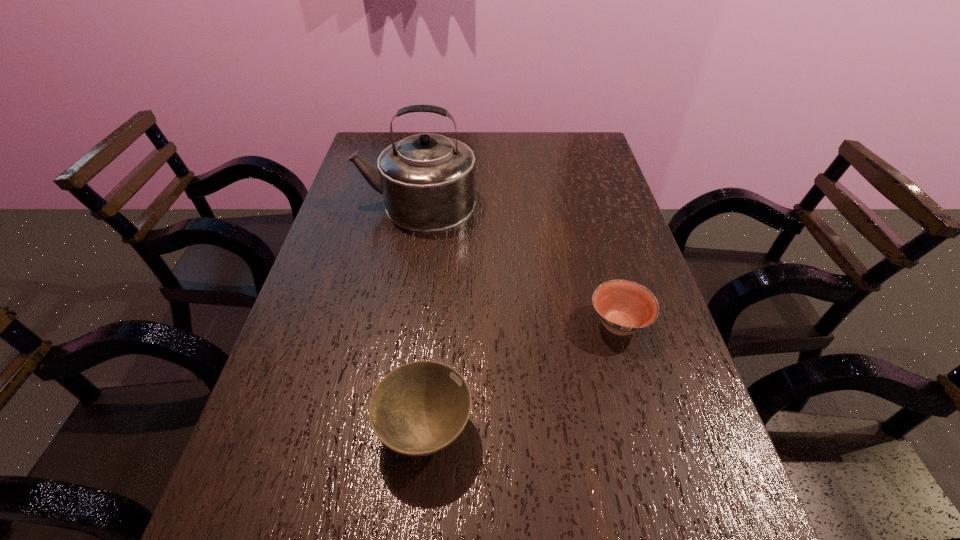
The width and height of the screenshot is (960, 540). What are the coordinates of `vacant space in between the farther bowl and the tallest object` in the screenshot? It's located at (517, 264).

Find the location of a particular element. free spot between the nearest object and the shortest object is located at coordinates (521, 377).

Image resolution: width=960 pixels, height=540 pixels. I want to click on free spot between the shortest object and the farthest object, so click(517, 264).

Where is `vacant point located between the second farthest object and the tallest object`? This screenshot has width=960, height=540. vacant point located between the second farthest object and the tallest object is located at coordinates (517, 264).

Find the location of a particular element. the second closest object to the rightmost object is located at coordinates (427, 180).

Identify which object is located as the second nearest to the taller bowl. Please provide its 2D coordinates. Your answer should be formatted as a tuple, i.e. [(x, y)], where the tuple contains the x and y coordinates of a point satisfying the conditions above.

[(427, 180)]

At what (x,y) coordinates should I click in order to perform the action: click on vacant space that satisfies the following two spatial constraints: 1. with the spout at the front of the tallest object; 2. on the right side of the second shortest object. Please return your answer as a coordinate pair (x, y). Image resolution: width=960 pixels, height=540 pixels. Looking at the image, I should click on (x=377, y=429).

The image size is (960, 540). I want to click on vacant region that satisfies the following two spatial constraints: 1. with the spout at the front of the tallest object; 2. on the right side of the taller bowl, so click(377, 429).

Locate an element on the screen. This screenshot has height=540, width=960. free location that satisfies the following two spatial constraints: 1. with the spout at the front of the tallest object; 2. on the right side of the nearest object is located at coordinates (377, 429).

Where is `free space that satisfies the following two spatial constraints: 1. with the spout at the front of the taller bowl; 2. on the right side of the farthest object`? This screenshot has height=540, width=960. free space that satisfies the following two spatial constraints: 1. with the spout at the front of the taller bowl; 2. on the right side of the farthest object is located at coordinates (377, 429).